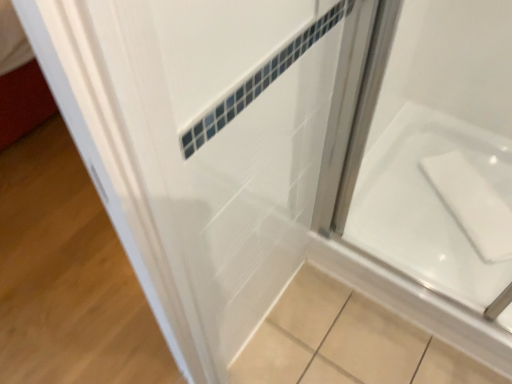
Question: Should I look upward or downward to see white glossy bath at lower right?

Choices:
 (A) up
 (B) down

Answer: (B)

Question: Is white glossy bath at lower right outside of white glossy door at upper left?

Choices:
 (A) yes
 (B) no

Answer: (A)

Question: Is white glossy bath at lower right behind white glossy door at upper left?

Choices:
 (A) no
 (B) yes

Answer: (B)

Question: Does white glossy bath at lower right have a larger size compared to white glossy door at upper left?

Choices:
 (A) no
 (B) yes

Answer: (B)

Question: From a real-world perspective, is white glossy bath at lower right below white glossy door at upper left?

Choices:
 (A) yes
 (B) no

Answer: (B)

Question: Can you confirm if white glossy bath at lower right is positioned to the left of white glossy door at upper left?

Choices:
 (A) no
 (B) yes

Answer: (A)

Question: Would you say white glossy bath at lower right contains white glossy door at upper left?

Choices:
 (A) yes
 (B) no

Answer: (B)

Question: From the image's perspective, is white glossy door at upper left on top of white glossy bath at lower right?

Choices:
 (A) no
 (B) yes

Answer: (A)

Question: Is the position of white glossy door at upper left less distant than that of white glossy bath at lower right?

Choices:
 (A) yes
 (B) no

Answer: (A)

Question: Considering the relative positions of white glossy door at upper left and white glossy bath at lower right in the image provided, is white glossy door at upper left to the right of white glossy bath at lower right from the viewer's perspective?

Choices:
 (A) no
 (B) yes

Answer: (A)

Question: Is white glossy bath at lower right completely or partially inside white glossy door at upper left?

Choices:
 (A) yes
 (B) no

Answer: (B)

Question: From a real-world perspective, is white glossy door at upper left physically below white glossy bath at lower right?

Choices:
 (A) no
 (B) yes

Answer: (B)

Question: Is white glossy door at upper left facing towards white glossy bath at lower right?

Choices:
 (A) no
 (B) yes

Answer: (A)

Question: Relative to white glossy door at upper left, is white glossy bath at lower right in front or behind?

Choices:
 (A) behind
 (B) front

Answer: (A)